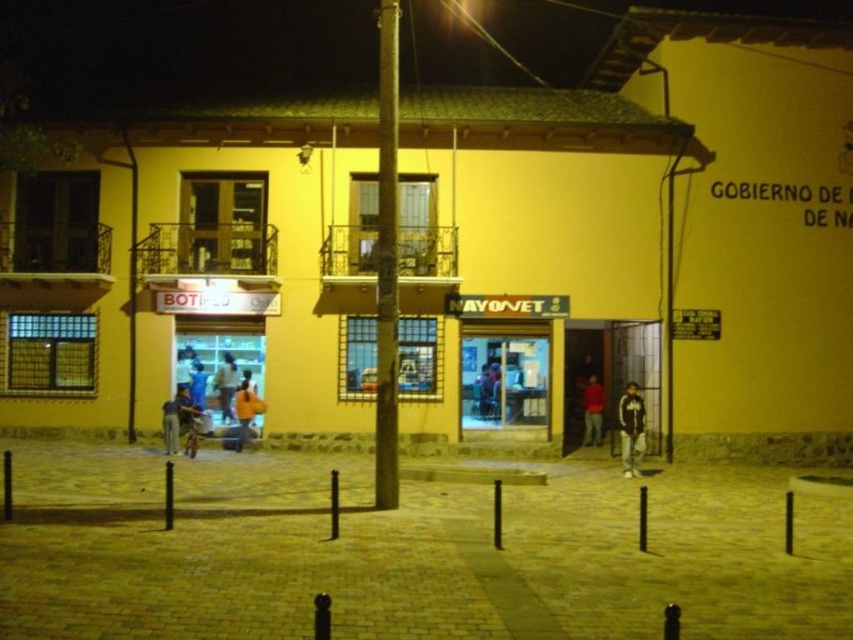
Question: Is smooth brown pole at center closer to the viewer compared to orange fabric bag at center?

Choices:
 (A) yes
 (B) no

Answer: (A)

Question: Which object is positioned closest to the orange fabric bag at center?

Choices:
 (A) orange fabric shirt at center
 (B) yellow matte building at center
 (C) smooth brown pole at center
 (D) dark blue jacket at center

Answer: (A)

Question: Is yellow matte building at center bigger than dark blue jacket at center?

Choices:
 (A) yes
 (B) no

Answer: (A)

Question: Which object is the closest to the smooth brown pole at center?

Choices:
 (A) dark blue jacket at center
 (B) orange fabric shirt at center
 (C) yellow matte building at center

Answer: (C)

Question: Estimate the real-world distances between objects in this image. Which object is closer to the yellow matte building at center?

Choices:
 (A) orange fabric shirt at center
 (B) orange fabric bag at center
 (C) smooth brown pole at center

Answer: (B)

Question: Can you confirm if red matte shirt at center is positioned to the left of orange fabric shirt at center?

Choices:
 (A) no
 (B) yes

Answer: (A)